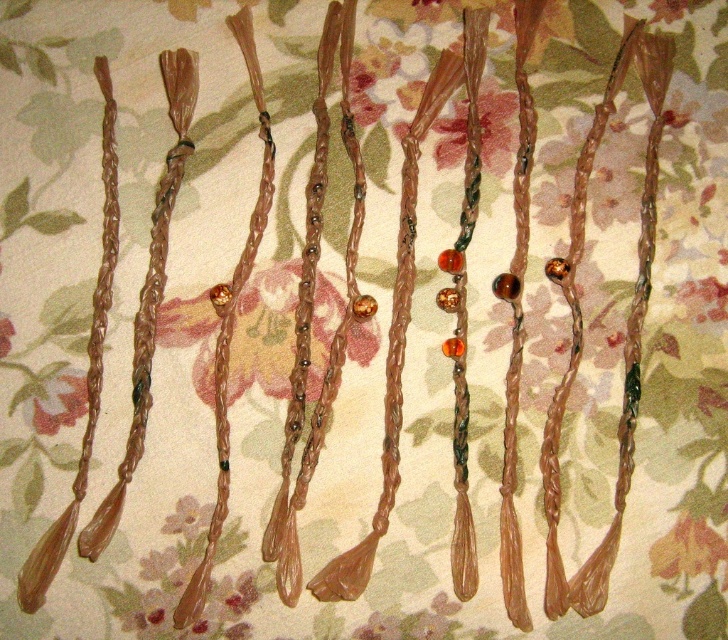
You are an artisan working with these materials. You need to choose an object that is larger for a project. Which one should you pick between the translucent amber beads at center and the matte floral fabric at lower left?

The translucent amber beads at center is bigger than the matte floral fabric at lower left, so you should pick the translucent amber beads at center for your project.

You are an interior designer arranging a display. You have a translucent plastic flower at center and a matte floral fabric at lower left. Which object is taller when placed side by side?

The translucent plastic flower at center is taller than the matte floral fabric at lower left according to the description.